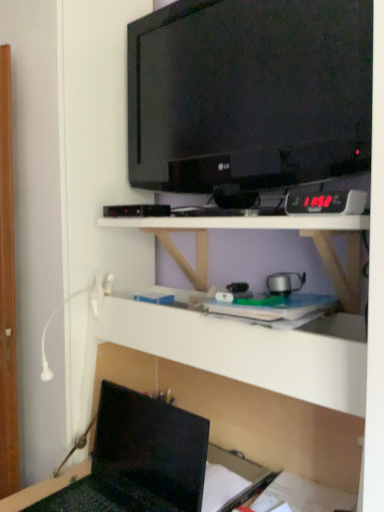
Question: Is white matte shelf at center, the second shelf positioned from the bottom, positioned far away from matte black laptop at lower left?

Choices:
 (A) no
 (B) yes

Answer: (A)

Question: Does white matte shelf at center, the second shelf positioned from the bottom, come behind matte black laptop at lower left?

Choices:
 (A) yes
 (B) no

Answer: (B)

Question: Is white matte shelf at center, which ranks as the first shelf in top-to-bottom order, wider than matte black laptop at lower left?

Choices:
 (A) no
 (B) yes

Answer: (B)

Question: From a real-world perspective, is white matte shelf at center, the second shelf positioned from the bottom, physically below matte black laptop at lower left?

Choices:
 (A) no
 (B) yes

Answer: (A)

Question: Is matte black laptop at lower left at the back of white matte shelf at center, which ranks as the first shelf in top-to-bottom order?

Choices:
 (A) yes
 (B) no

Answer: (B)

Question: Is white matte shelf at center, the second shelf positioned from the bottom, shorter than matte black laptop at lower left?

Choices:
 (A) no
 (B) yes

Answer: (B)

Question: Considering the relative sizes of white matte shelf at center, the second shelf positioned from the bottom, and black glossy tv at upper center in the image provided, is white matte shelf at center, the second shelf positioned from the bottom, bigger than black glossy tv at upper center?

Choices:
 (A) no
 (B) yes

Answer: (B)

Question: Can you confirm if white matte shelf at center, the second shelf positioned from the bottom, is taller than black glossy tv at upper center?

Choices:
 (A) yes
 (B) no

Answer: (B)

Question: Is white matte shelf at center, which ranks as the first shelf in top-to-bottom order, oriented towards black glossy tv at upper center?

Choices:
 (A) yes
 (B) no

Answer: (B)

Question: Does white matte shelf at center, the second shelf positioned from the bottom, lie in front of black glossy tv at upper center?

Choices:
 (A) yes
 (B) no

Answer: (A)

Question: Does white matte shelf at center, which ranks as the first shelf in top-to-bottom order, have a greater width compared to black glossy tv at upper center?

Choices:
 (A) no
 (B) yes

Answer: (B)

Question: From the image's perspective, is white matte shelf at center, which ranks as the first shelf in top-to-bottom order, located above black glossy tv at upper center?

Choices:
 (A) no
 (B) yes

Answer: (A)

Question: Is black glossy tv at upper center positioned before matte black laptop at lower left?

Choices:
 (A) yes
 (B) no

Answer: (B)